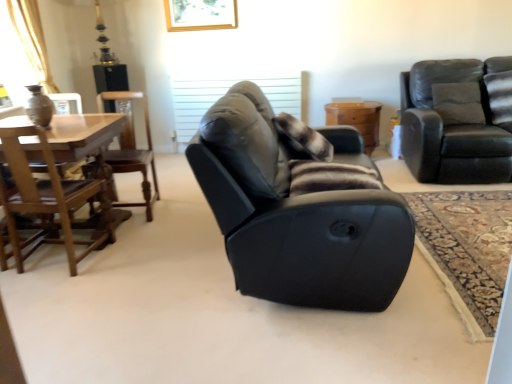
Where is `vacant space to the right of wooden chair at left, the 4th chair from the right`? This screenshot has width=512, height=384. vacant space to the right of wooden chair at left, the 4th chair from the right is located at coordinates (134, 251).